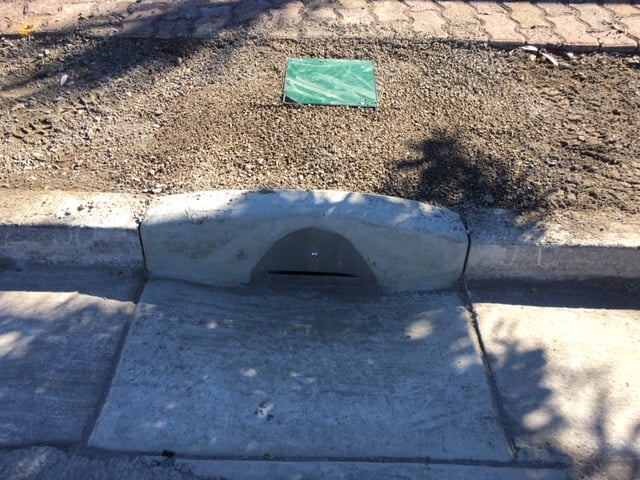
At what (x,y) coordinates should I click in order to perform the action: click on glass. Please return your answer as a coordinate pair (x, y). Looking at the image, I should click on (344, 80).